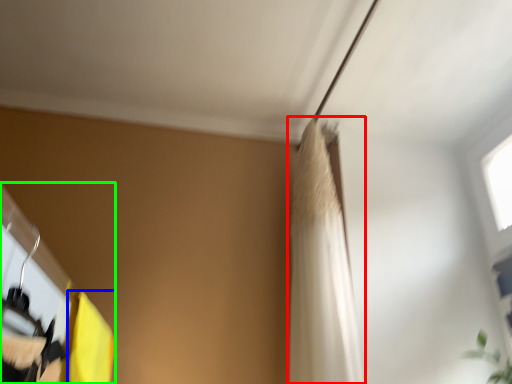
Question: Which object is the closest to the shower curtain (highlighted by a red box)? Choose among these: curtain (highlighted by a blue box) or closet (highlighted by a green box).

Choices:
 (A) curtain
 (B) closet

Answer: (A)